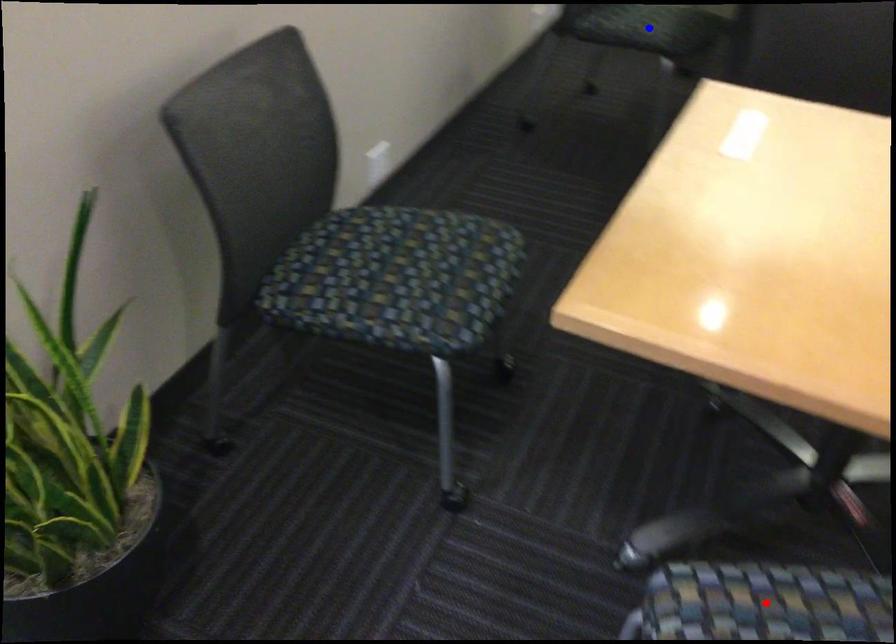
Question: In the image, two points are highlighted. Which point is nearer to the camera? Reply with the corresponding letter.

Choices:
 (A) blue point
 (B) red point

Answer: (B)